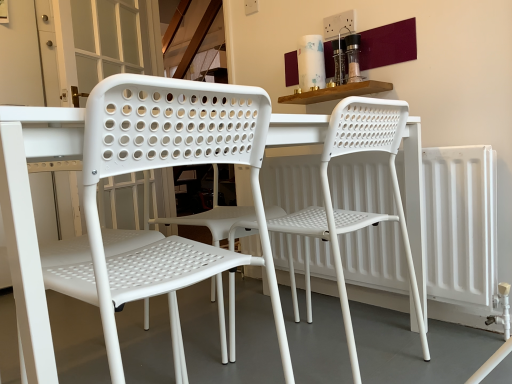
Where is `vacant point to the left of white matte radiator at right`? The image size is (512, 384). vacant point to the left of white matte radiator at right is located at coordinates (326, 335).